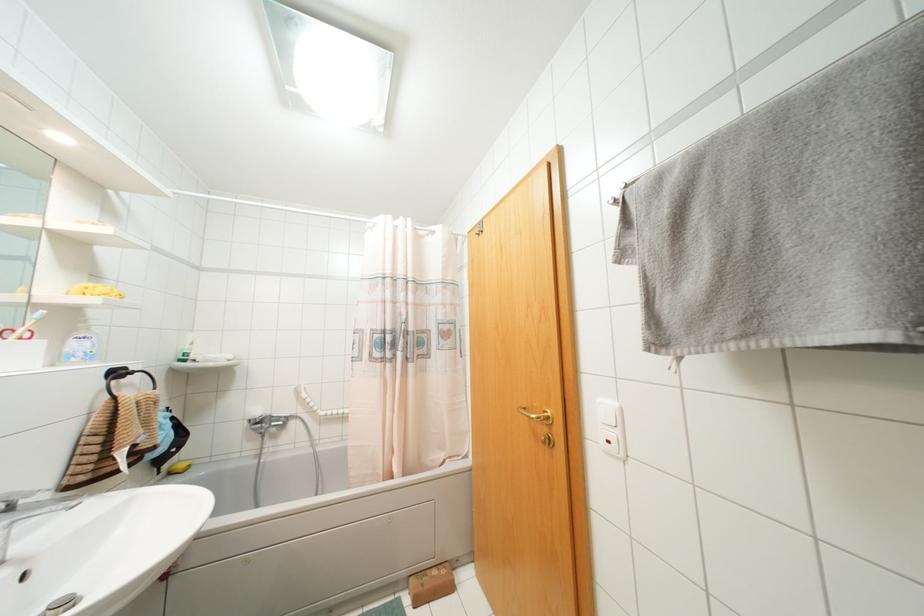
This screenshot has height=616, width=924. Find the location of `brass door handle`. brass door handle is located at coordinates (537, 415).